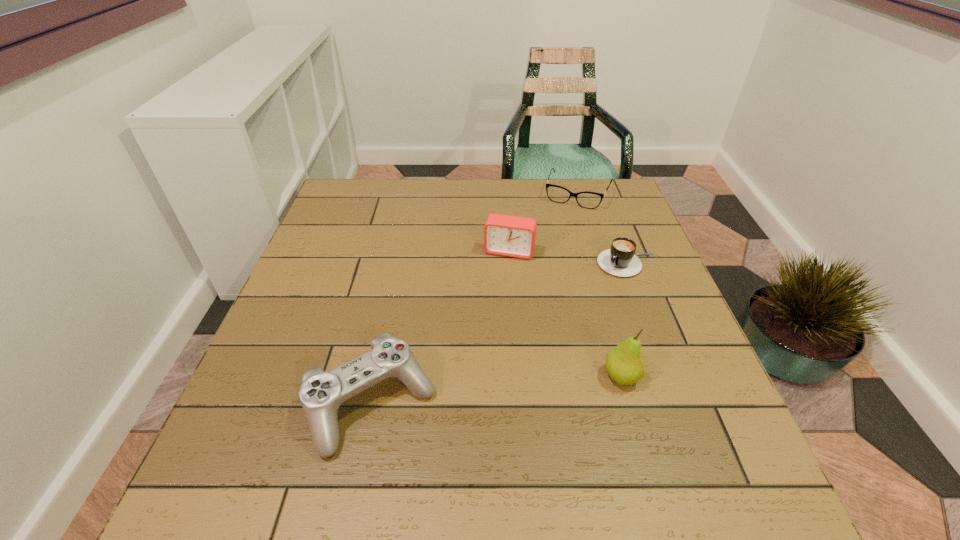
Where is `free spot between the third shortest object and the farthest object`? The image size is (960, 540). free spot between the third shortest object and the farthest object is located at coordinates (475, 299).

Locate an element on the screen. vacant area that lies between the pear and the leftmost object is located at coordinates (496, 390).

Identify which object is the fourth nearest to the cappuccino. Please provide its 2D coordinates. Your answer should be formatted as a tuple, i.e. [(x, y)], where the tuple contains the x and y coordinates of a point satisfying the conditions above.

[(321, 394)]

Point out which object is positioned as the third nearest to the cappuccino. Please provide its 2D coordinates. Your answer should be formatted as a tuple, i.e. [(x, y)], where the tuple contains the x and y coordinates of a point satisfying the conditions above.

[(624, 364)]

You are a GUI agent. You are given a task and a screenshot of the screen. Output one action in this format:
    pyautogui.click(x=<x>, y=<y>)
    Task: Click on the free point that satisfies the following two spatial constraints: 1. on the front side of the second object from left to right; 2. on the right side of the cappuccino
    
    Given the screenshot: What is the action you would take?
    [x=510, y=264]

Find the location of a particular element. The width and height of the screenshot is (960, 540). vacant space that satisfies the following two spatial constraints: 1. on the front side of the cappuccino; 2. on the right side of the alarm clock is located at coordinates (510, 264).

This screenshot has width=960, height=540. I want to click on free region that satisfies the following two spatial constraints: 1. on the front side of the tallest object; 2. on the right side of the second tallest object, so click(x=519, y=376).

This screenshot has width=960, height=540. I want to click on free space that satisfies the following two spatial constraints: 1. on the back side of the farthest object; 2. on the left side of the control, so pyautogui.click(x=416, y=194).

The width and height of the screenshot is (960, 540). What are the coordinates of `vacant region that satisfies the following two spatial constraints: 1. on the back side of the leftmost object; 2. on the left side of the alarm clock` in the screenshot? It's located at (404, 252).